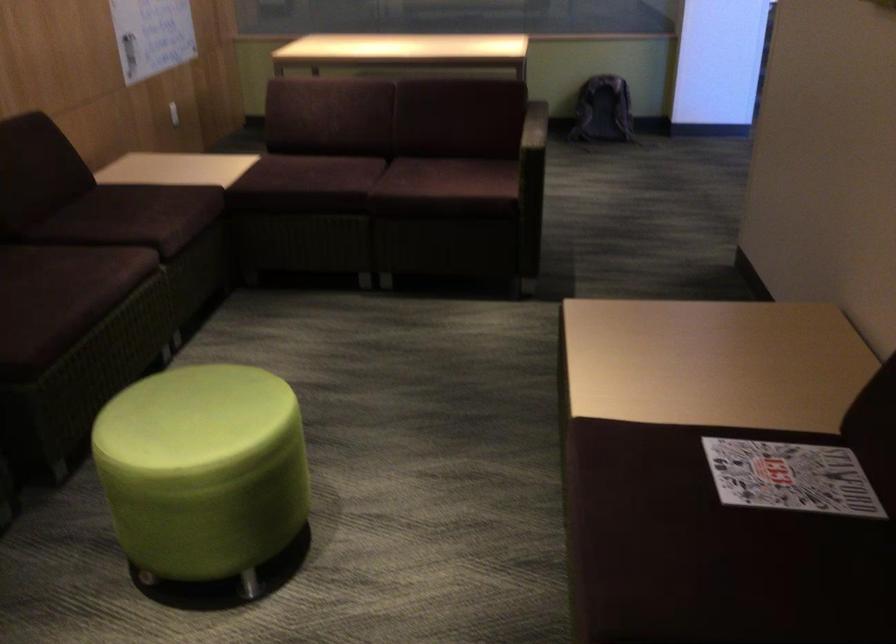
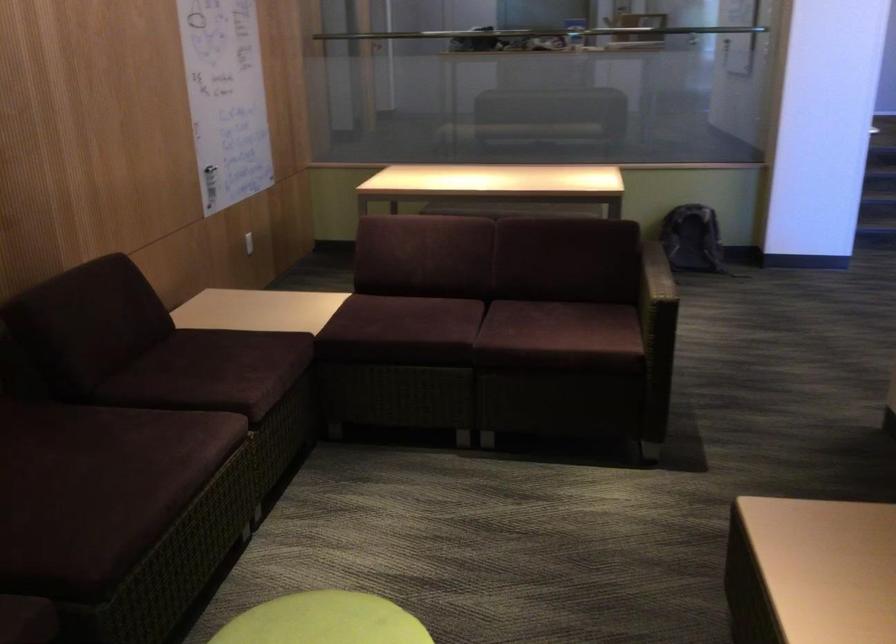
Which direction would the cameraman need to move to produce the second image?

The cameraman moved toward left, forward.